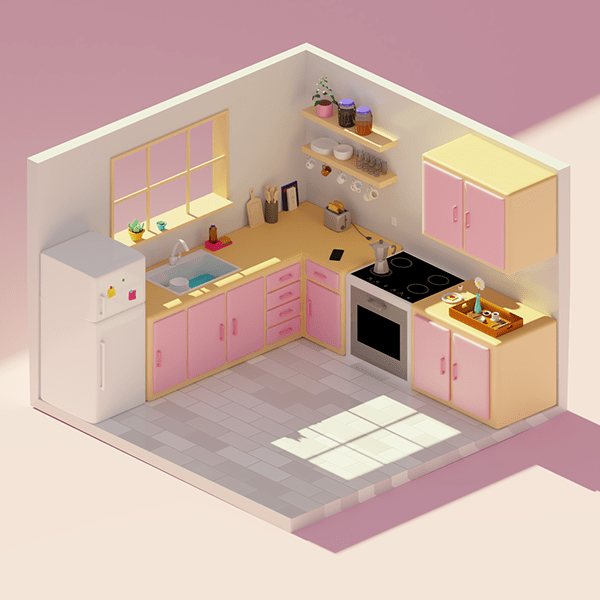
Locate an element on the screen. The height and width of the screenshot is (600, 600). black stovetop is located at coordinates (410, 275).